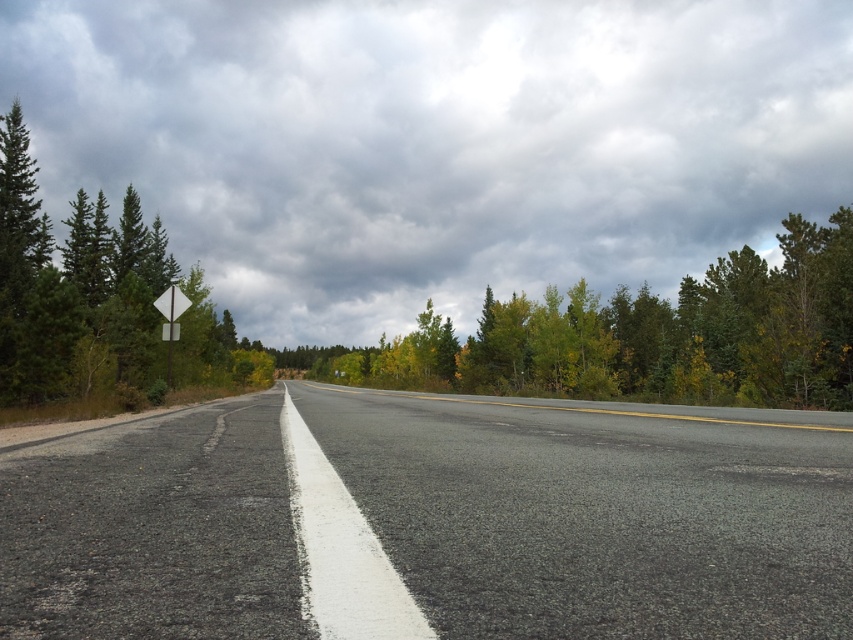
This screenshot has width=853, height=640. What do you see at coordinates (585, 513) in the screenshot?
I see `asphalt road at center` at bounding box center [585, 513].

Does point (788, 541) lie in front of point (757, 317)?

Yes, point (788, 541) is in front of point (757, 317).

This screenshot has width=853, height=640. I want to click on asphalt road at center, so coord(585,513).

Can you confirm if cloudy sky at upper center is shorter than green leafy trees at upper center?

No.

Can you confirm if cloudy sky at upper center is wider than green leafy trees at upper center?

Correct, the width of cloudy sky at upper center exceeds that of green leafy trees at upper center.

Find the location of a particular element. cloudy sky at upper center is located at coordinates (436, 141).

Identify the location of cloudy sky at upper center. This screenshot has width=853, height=640. (436, 141).

Is asphalt road at center bigger than white plastic diamond-shaped sign at upper left?

Correct, asphalt road at center is larger in size than white plastic diamond-shaped sign at upper left.

Is point (703, 584) behind point (165, 332)?

That is False.

What do you see at coordinates (585, 513) in the screenshot? I see `asphalt road at center` at bounding box center [585, 513].

Locate an element on the screen. asphalt road at center is located at coordinates (585, 513).